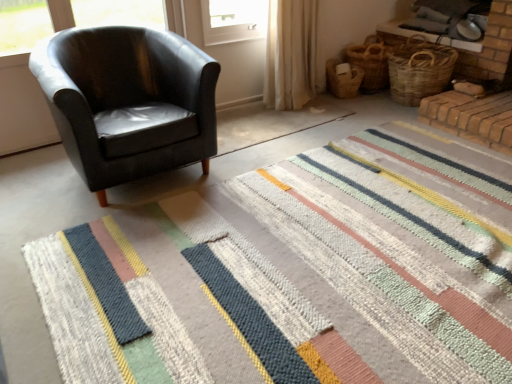
Image resolution: width=512 pixels, height=384 pixels. What are the coordinates of `empty space that is ontop of striped woolen rug at center` in the screenshot? It's located at (261, 269).